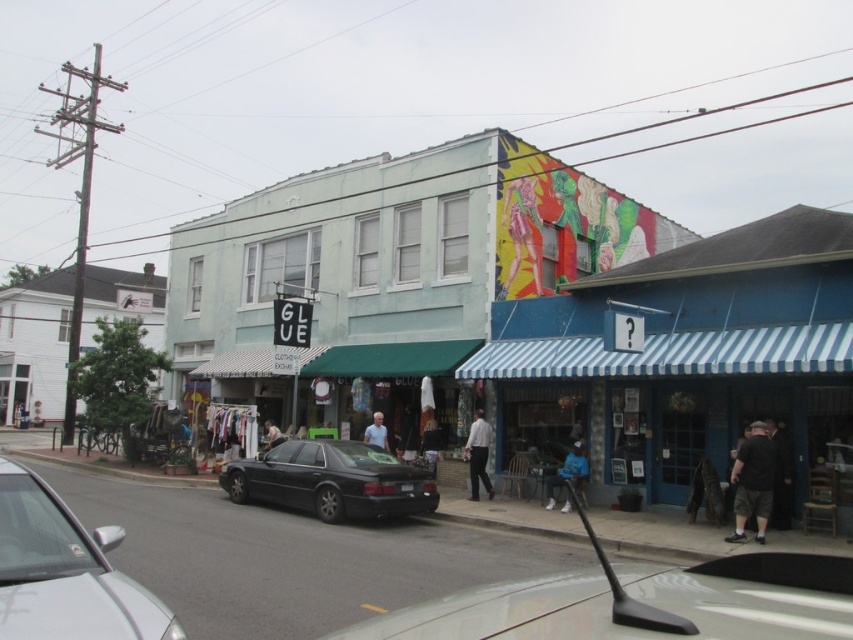
Question: Is the position of blue fabric jacket at lower center more distant than that of light brown leather jacket at center?

Choices:
 (A) yes
 (B) no

Answer: (B)

Question: Which object is closer to the camera taking this photo?

Choices:
 (A) blue fabric jacket at lower center
 (B) dark gray shorts at lower right
 (C) gray fabric shirt at center

Answer: (B)

Question: Which of the following is the closest to the observer?

Choices:
 (A) (282, 440)
 (B) (733, 532)

Answer: (B)

Question: Does white cotton shirt at center appear on the left side of blue fabric jacket at lower center?

Choices:
 (A) yes
 (B) no

Answer: (A)

Question: Which of these objects is positioned farthest from the gray fabric shirt at center?

Choices:
 (A) light brown leather jacket at center
 (B) dark gray shorts at lower right
 (C) blue fabric jacket at lower center

Answer: (B)

Question: Does dark gray shorts at lower right lie in front of white cotton shirt at center?

Choices:
 (A) no
 (B) yes

Answer: (B)